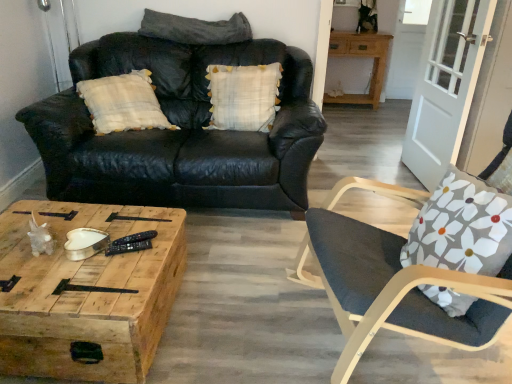
Question: Is wooden table at upper right oriented away from white wood screen door at right?

Choices:
 (A) no
 (B) yes

Answer: (A)

Question: Considering the relative positions of wooden table at upper right and white wood screen door at right in the image provided, is wooden table at upper right to the right of white wood screen door at right from the viewer's perspective?

Choices:
 (A) yes
 (B) no

Answer: (B)

Question: Could you tell me if wooden table at upper right is turned towards white wood screen door at right?

Choices:
 (A) yes
 (B) no

Answer: (A)

Question: Does wooden table at upper right appear on the left side of white wood screen door at right?

Choices:
 (A) no
 (B) yes

Answer: (B)

Question: Can you confirm if wooden table at upper right is smaller than white wood screen door at right?

Choices:
 (A) yes
 (B) no

Answer: (B)

Question: Can you confirm if wooden table at upper right is shorter than white wood screen door at right?

Choices:
 (A) yes
 (B) no

Answer: (A)

Question: Is white plaid pillow at center, marked as the first pillow in a bottom-to-top arrangement, positioned with its back to floral fabric cushion at right?

Choices:
 (A) yes
 (B) no

Answer: (B)

Question: Could you tell me if white plaid pillow at center, which ranks as the 2th pillow in top-to-bottom order, is facing floral fabric cushion at right?

Choices:
 (A) yes
 (B) no

Answer: (B)

Question: Can you confirm if white plaid pillow at center, which ranks as the 2th pillow in top-to-bottom order, is thinner than floral fabric cushion at right?

Choices:
 (A) no
 (B) yes

Answer: (B)

Question: Can you confirm if white plaid pillow at center, which ranks as the 2th pillow in top-to-bottom order, is bigger than floral fabric cushion at right?

Choices:
 (A) yes
 (B) no

Answer: (B)

Question: Does white plaid pillow at center, marked as the first pillow in a bottom-to-top arrangement, contain floral fabric cushion at right?

Choices:
 (A) yes
 (B) no

Answer: (B)

Question: Is white plaid pillow at center, which ranks as the 2th pillow in top-to-bottom order, at the right side of floral fabric cushion at right?

Choices:
 (A) yes
 (B) no

Answer: (B)

Question: From a real-world perspective, is white wood screen door at right located higher than floral fabric cushion at right?

Choices:
 (A) no
 (B) yes

Answer: (B)